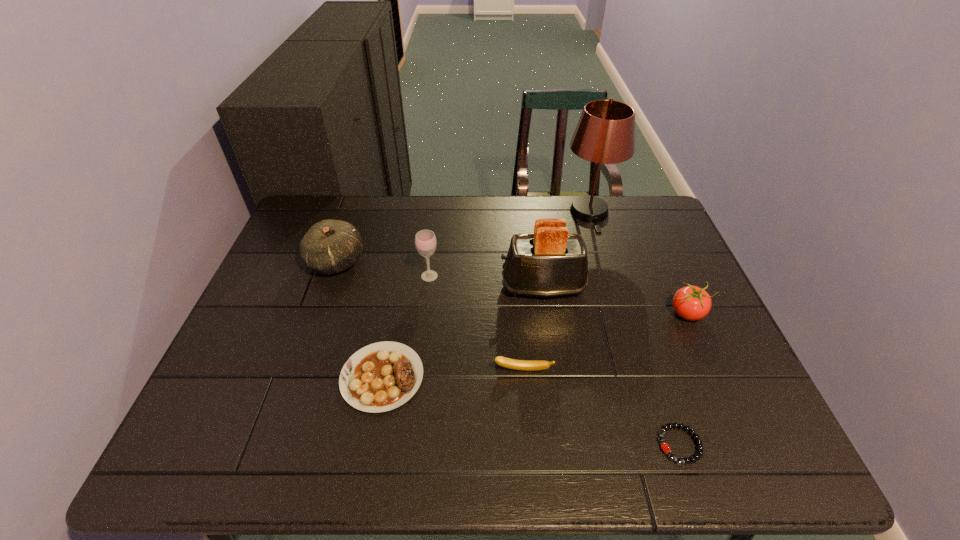
Identify the location of vacant space at the near edge of the desktop. The image size is (960, 540). (590, 464).

Locate an element on the screen. Image resolution: width=960 pixels, height=540 pixels. free space at the left edge of the desktop is located at coordinates (291, 333).

Where is `free space at the right edge of the desktop`? The height and width of the screenshot is (540, 960). free space at the right edge of the desktop is located at coordinates (647, 303).

Locate an element on the screen. Image resolution: width=960 pixels, height=540 pixels. free space at the far left corner of the desktop is located at coordinates (319, 209).

Identify the location of vacant region at the far right corner of the desktop. This screenshot has height=540, width=960. (636, 207).

You are a GUI agent. You are given a task and a screenshot of the screen. Output one action in this format:
    pyautogui.click(x=<x>, y=<y>)
    Task: Click on the free space between the farthest object and the rightmost object
    
    Given the screenshot: What is the action you would take?
    pyautogui.click(x=638, y=264)

Find the location of a particular element. vacant area between the wineglass and the seventh tallest object is located at coordinates (406, 327).

This screenshot has height=540, width=960. Identify the location of free space that is in between the tomato and the banana. 606,342.

I want to click on vacant space in between the bracelet and the banana, so click(x=601, y=407).

I want to click on vacant area that lies between the gourd and the tallest object, so click(x=463, y=238).